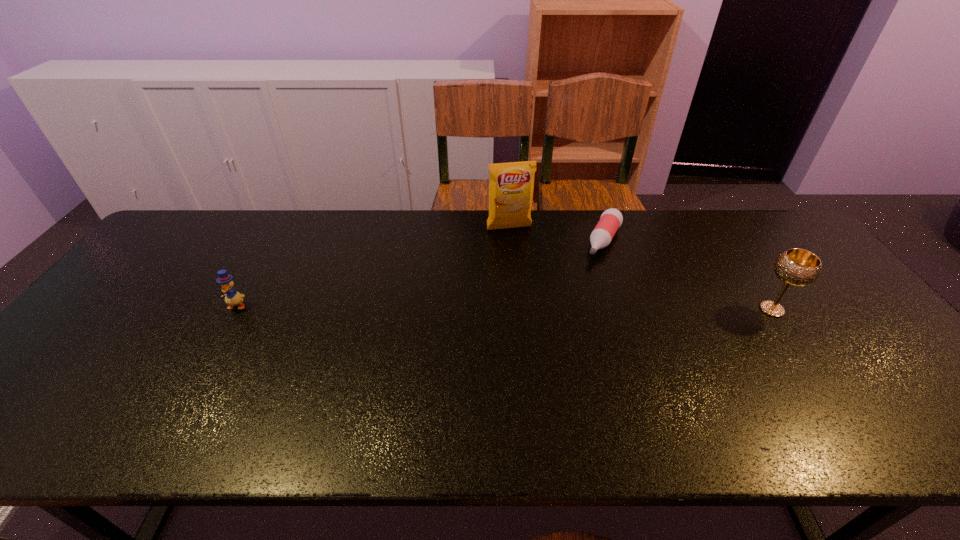
Locate an element on the screen. Image resolution: width=960 pixels, height=540 pixels. empty location between the leftmost object and the second object from right to left is located at coordinates (420, 273).

Image resolution: width=960 pixels, height=540 pixels. I want to click on free space that is in between the bottle and the third shortest object, so click(x=687, y=275).

The width and height of the screenshot is (960, 540). Identify the location of free space between the crisp (potato chip) and the bottle. (556, 234).

Identify which object is located as the third nearest to the duckling. Please provide its 2D coordinates. Your answer should be formatted as a tuple, i.e. [(x, y)], where the tuple contains the x and y coordinates of a point satisfying the conditions above.

[(797, 267)]

The image size is (960, 540). Identify the location of the closest object to the rightmost object. (611, 219).

You are a GUI agent. You are given a task and a screenshot of the screen. Output one action in this format:
    pyautogui.click(x=<x>, y=<y>)
    Task: Click on the vacant space that satisfies the following two spatial constraints: 1. on the face of the second shortest object, where the monocle is placed; 2. on the left side of the chalice
    
    Given the screenshot: What is the action you would take?
    pyautogui.click(x=234, y=309)